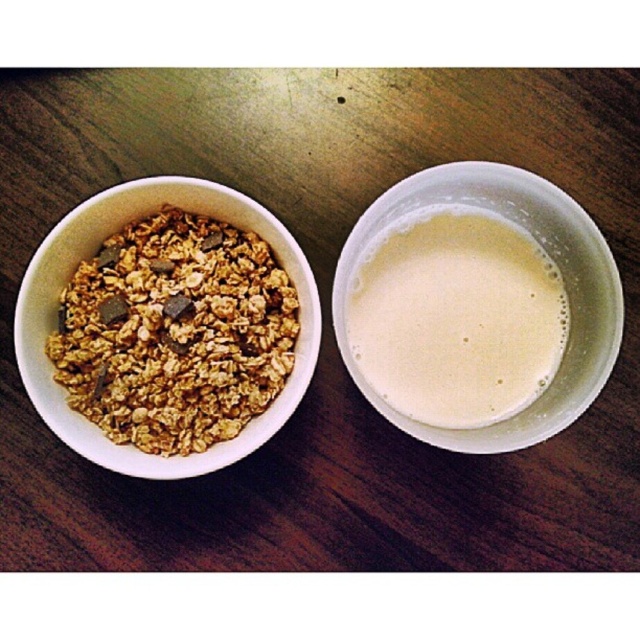
Looking at this image, you are a chef preparing a meal and need to place the white creamy liquid at right and the matte ceramic bowl at left onto a tray. If you want to arrange them so that the liquid container is on the right side of the tray, which object should you place on the left side of the tray?

You should place the matte ceramic bowl at left on the left side of the tray because the white creamy liquid at right is already positioned to the right of the matte ceramic bowl at left, so moving them accordingly maintains their original arrangement.

You are a chef preparing a meal and need to pour the white creamy liquid at right into the matte ceramic bowl at left. The space between them is narrow. Can you safely pour the liquid without spilling? Explain your reasoning.

The distance between the white creamy liquid at right and the matte ceramic bowl at left is 11.33 inches. Since this distance is sufficient to allow pouring without needing to lift the container too high, the chef can safely pour the liquid into the bowl without spilling.